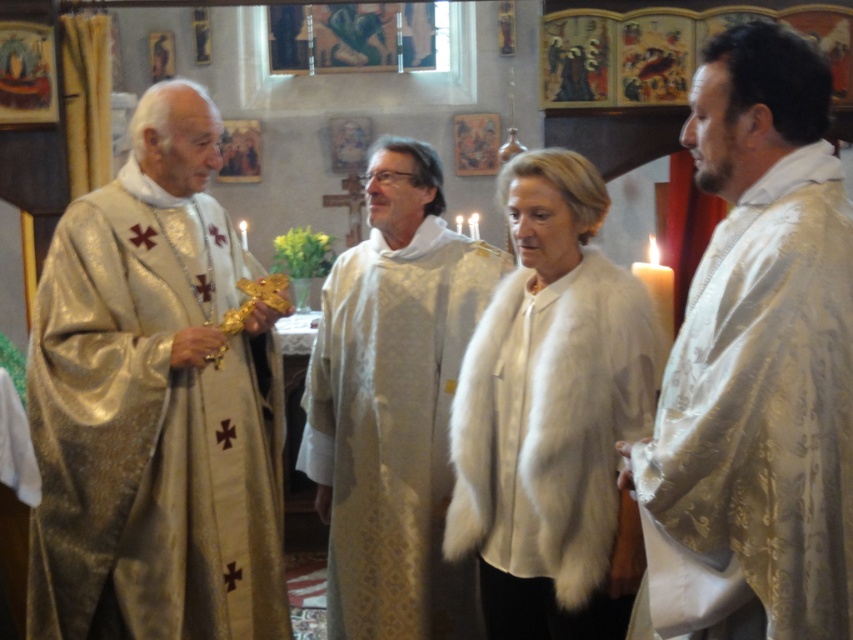
Question: Which object appears farthest from the camera in this image?

Choices:
 (A) silky gold robe at center
 (B) white fur coat at center
 (C) shiny gold robe at left

Answer: (A)

Question: From the image, what is the correct spatial relationship of silky gold robe at right in relation to white fur coat at center?

Choices:
 (A) left
 (B) right

Answer: (B)

Question: Which point is closer to the camera?

Choices:
 (A) (354, 268)
 (B) (798, 228)

Answer: (B)

Question: Can you confirm if shiny gold robe at left is positioned to the right of silky gold robe at center?

Choices:
 (A) no
 (B) yes

Answer: (A)

Question: Can you confirm if shiny gold robe at left is bigger than silky gold robe at center?

Choices:
 (A) no
 (B) yes

Answer: (B)

Question: Which object appears closest to the camera in this image?

Choices:
 (A) silky gold robe at center
 (B) shiny gold robe at left
 (C) silky gold robe at right

Answer: (C)